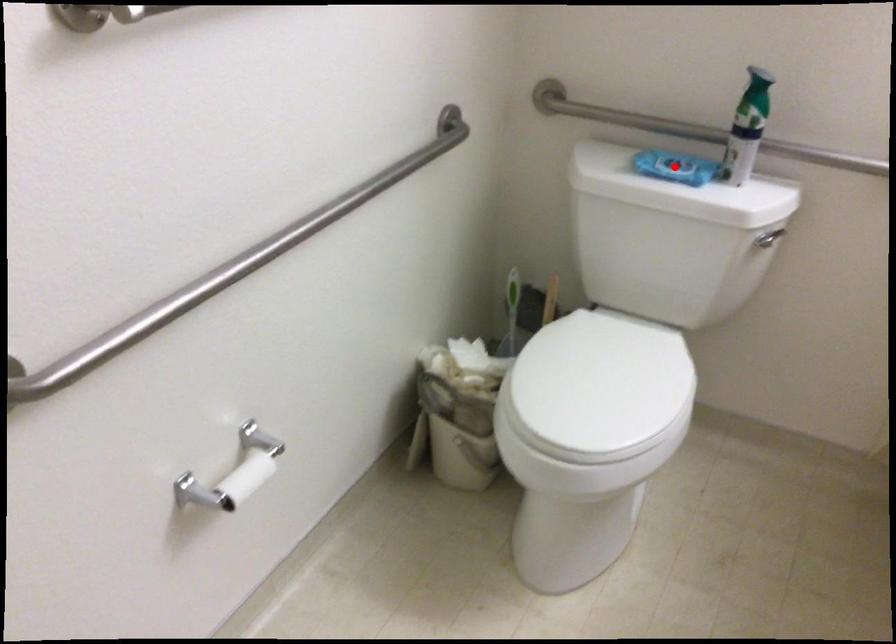
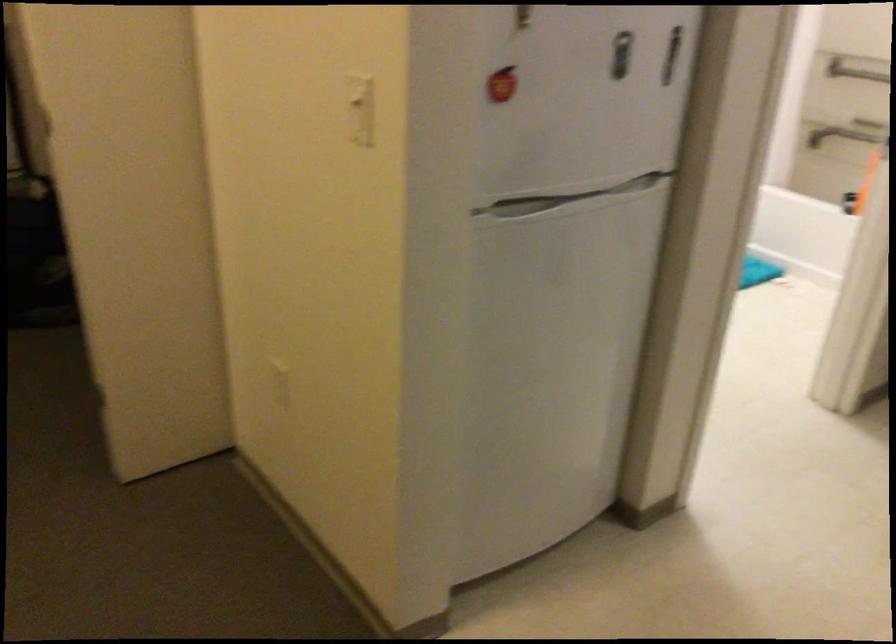
Question: I am providing you with two images of the same scene from different viewpoints. A red point is marked on the first image. At the location where the point appears in image 1, is it still visible in image 2?

Choices:
 (A) Yes
 (B) No

Answer: (B)